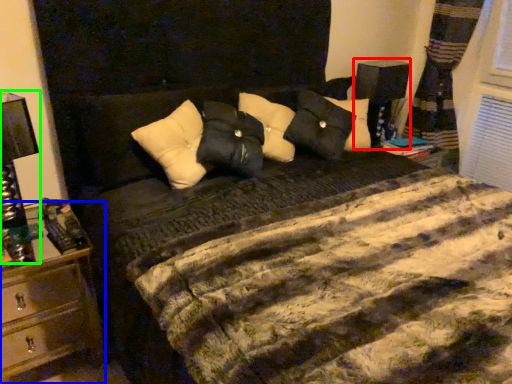
Question: Considering the real-world distances, which object is closest to bedside lamp (highlighted by a red box)? nightstand (highlighted by a blue box) or bedside lamp (highlighted by a green box).

Choices:
 (A) nightstand
 (B) bedside lamp

Answer: (A)